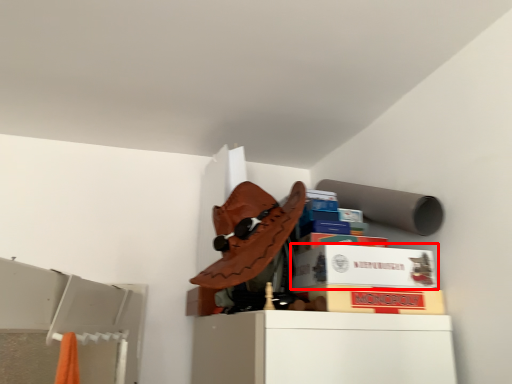
Question: Observing the image, what is the correct spatial positioning of cardboard box (annotated by the red box) in reference to cardboard box?

Choices:
 (A) left
 (B) right

Answer: (A)